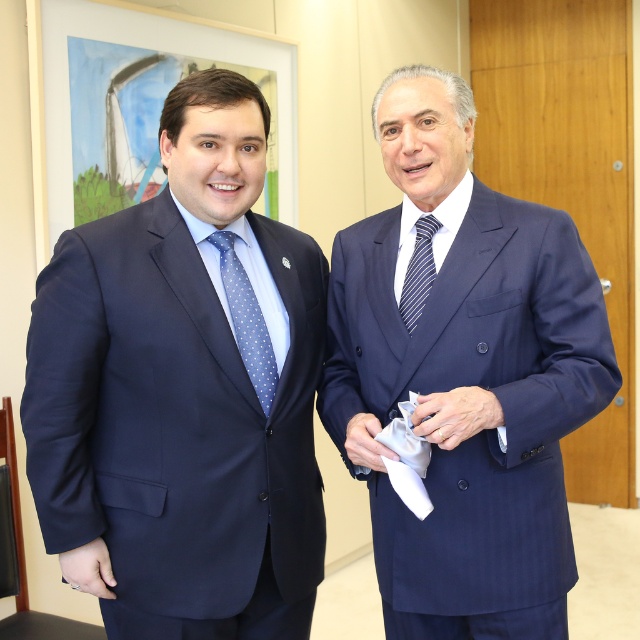
You are standing in an office and want to reach a point that is 1.44 meters away from you. Can you walk straight ahead to reach the point labeled as point (252, 465)?

Yes, since the point (252, 465) is 1.44 meters away from the viewer, you can walk straight ahead to reach it.

You are a tailor measuring a client for a custom suit. You notice the matte blue suit at center and the blue dotted tie at left. Which item is taller?

The matte blue suit at center is taller than the blue dotted tie at left.